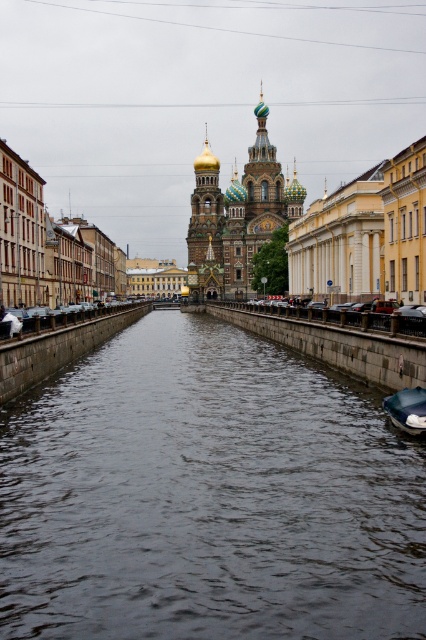
You are a GUI agent. You are given a task and a screenshot of the screen. Output one action in this format:
    pyautogui.click(x=<x>, y=<y>)
    Task: Click on the dark gray concrete river at center
    The width and height of the screenshot is (426, 640).
    Given the screenshot: What is the action you would take?
    pyautogui.click(x=207, y=497)

Is dark gray concrete river at center wider than golden domed cathedral at center?

Yes.

The image size is (426, 640). In order to click on dark gray concrete river at center in this screenshot , I will do `click(207, 497)`.

Is golden domed cathedral at center taller than dark blue fabric boat at lower right?

Indeed, golden domed cathedral at center has a greater height compared to dark blue fabric boat at lower right.

Is point (210, 248) behind point (402, 429)?

That is True.

This screenshot has height=640, width=426. In order to click on golden domed cathedral at center in this screenshot , I will do `click(236, 216)`.

How far apart are dark gray concrete river at center and dark blue fabric boat at lower right?

dark gray concrete river at center is 53.52 feet away from dark blue fabric boat at lower right.

Measure the distance between point (405,552) and camera.

The distance of point (405,552) from camera is 58.92 meters.

Locate an element on the screen. The width and height of the screenshot is (426, 640). dark gray concrete river at center is located at coordinates (207, 497).